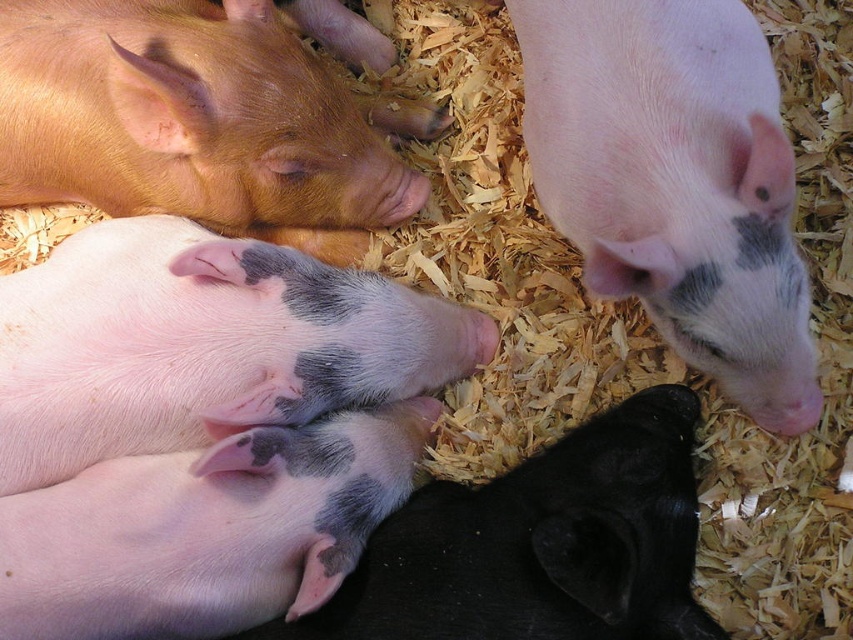
Question: Does white matte piglet at upper right come in front of pink smooth piglet at center?

Choices:
 (A) yes
 (B) no

Answer: (A)

Question: Among these points, which one is nearest to the camera?

Choices:
 (A) (229, 540)
 (B) (527, 556)

Answer: (B)

Question: Does matte orange piglet at upper left have a lesser width compared to speckled pink piglet at center?

Choices:
 (A) yes
 (B) no

Answer: (B)

Question: Based on their relative distances, which object is farther from the pink smooth piglet at lower left?

Choices:
 (A) white matte piglet at upper right
 (B) pink smooth piglet at center

Answer: (A)

Question: Which object is farther from the camera taking this photo?

Choices:
 (A) speckled pink piglet at center
 (B) white matte piglet at upper right
 (C) pink smooth piglet at center
 (D) pink smooth piglet at lower left

Answer: (C)

Question: Can you confirm if white matte piglet at upper right is positioned below matte orange piglet at upper left?

Choices:
 (A) yes
 (B) no

Answer: (A)